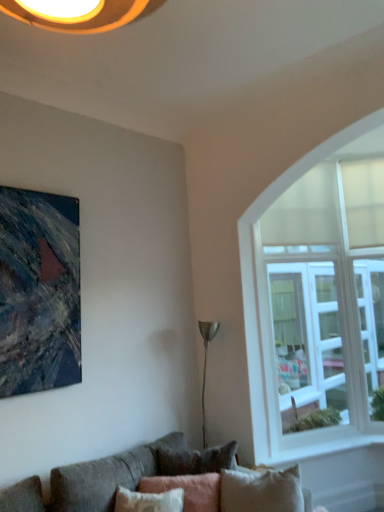
Question: Is white glass window at right at the right side of textured gray couch at lower left?

Choices:
 (A) yes
 (B) no

Answer: (A)

Question: Is white glass window at right positioned in front of textured gray couch at lower left?

Choices:
 (A) yes
 (B) no

Answer: (B)

Question: From the image's perspective, does white glass window at right appear higher than textured gray couch at lower left?

Choices:
 (A) no
 (B) yes

Answer: (B)

Question: From the image's perspective, is white glass window at right beneath textured gray couch at lower left?

Choices:
 (A) no
 (B) yes

Answer: (A)

Question: Is white glass window at right wider than textured gray couch at lower left?

Choices:
 (A) yes
 (B) no

Answer: (B)

Question: From a real-world perspective, is textured gray couch at lower left physically located above or below pink fabric pillow at lower center?

Choices:
 (A) above
 (B) below

Answer: (B)

Question: In the image, is textured gray couch at lower left on the left side or the right side of pink fabric pillow at lower center?

Choices:
 (A) left
 (B) right

Answer: (B)

Question: In terms of width, does textured gray couch at lower left look wider or thinner when compared to pink fabric pillow at lower center?

Choices:
 (A) thin
 (B) wide

Answer: (B)

Question: Is point (9, 487) positioned closer to the camera than point (213, 483)?

Choices:
 (A) farther
 (B) closer

Answer: (B)

Question: Considering the positions of white glass window at right and textured canvas painting at upper left in the image, is white glass window at right taller or shorter than textured canvas painting at upper left?

Choices:
 (A) tall
 (B) short

Answer: (A)

Question: Is white glass window at right inside the boundaries of textured canvas painting at upper left, or outside?

Choices:
 (A) outside
 (B) inside

Answer: (A)

Question: Considering the positions of point (241, 233) and point (52, 214), is point (241, 233) closer or farther from the camera than point (52, 214)?

Choices:
 (A) closer
 (B) farther

Answer: (B)

Question: From a real-world perspective, is white glass window at right positioned above or below textured canvas painting at upper left?

Choices:
 (A) above
 (B) below

Answer: (B)

Question: In the image, is textured canvas painting at upper left on the left side or the right side of white glass window at right?

Choices:
 (A) right
 (B) left

Answer: (B)

Question: Is textured canvas painting at upper left in front of or behind white glass window at right in the image?

Choices:
 (A) front
 (B) behind

Answer: (A)